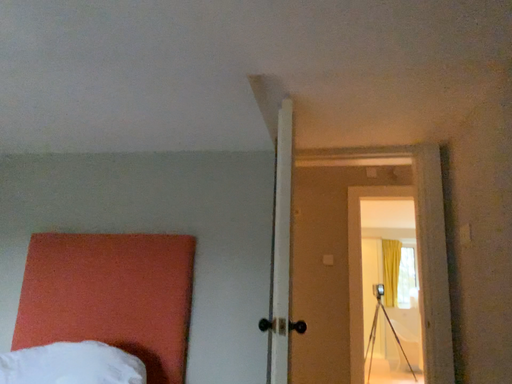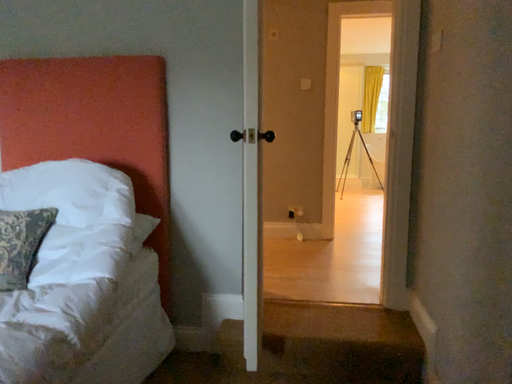
Question: Which way did the camera rotate in the video?

Choices:
 (A) rotated upward
 (B) rotated downward

Answer: (B)